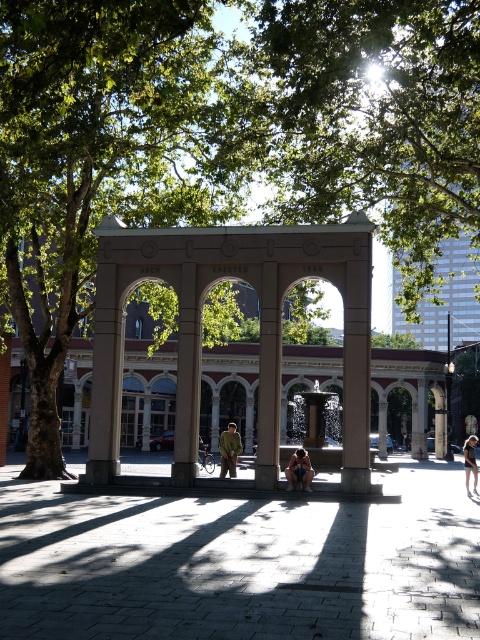
You are a photographer standing in the park and want to capture both the matte pink stone archway at center and the khaki fabric jacket at center in a single shot. Which object should you position closer to the left side of your camera frame?

The khaki fabric jacket at center should be positioned closer to the left side of your camera frame because the matte pink stone archway at center is on the right side of it.

You are standing in the park and notice the smooth stone column at center and the matte brown person at center. Which object is positioned higher relative to the other?

The smooth stone column at center is positioned higher than the matte brown person at center.

You are a photographer planning to take a portrait under the archway. You want to ensure that the entire khaki fabric jacket at center is visible in the frame without being blocked by the matte pink stone archway at center. Given their sizes, is this possible?

The matte pink stone archway at center is taller than the khaki fabric jacket at center. Since the archway is taller, it should not block the entire jacket in the portrait unless positioned directly in front of it. Ensure the jacket is placed away from the archway or adjust the camera angle to avoid obstruction.